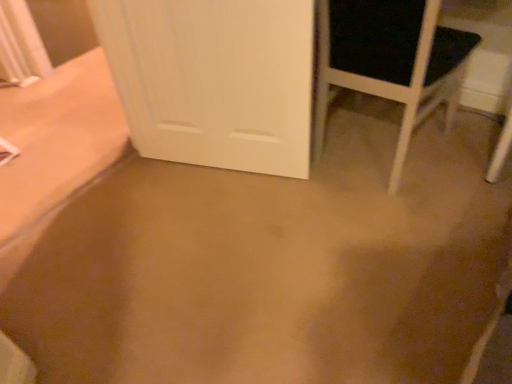
This screenshot has height=384, width=512. Describe the element at coordinates (214, 79) in the screenshot. I see `white wood door at center` at that location.

Locate an element on the screen. This screenshot has width=512, height=384. white wood door at center is located at coordinates (214, 79).

Describe the element at coordinates (390, 61) in the screenshot. I see `black matte chair at right` at that location.

Locate an element on the screen. The width and height of the screenshot is (512, 384). black matte chair at right is located at coordinates (390, 61).

Where is `white wood door at center`? The width and height of the screenshot is (512, 384). white wood door at center is located at coordinates (214, 79).

In the image, is black matte chair at right on the left side or the right side of white wood door at center?

From the image, it's evident that black matte chair at right is to the right of white wood door at center.

Is black matte chair at right positioned behind white wood door at center?

No, it is not.

Does point (391, 32) appear closer or farther from the camera than point (165, 70)?

Point (391, 32) appears to be closer to the viewer than point (165, 70).

From the image's perspective, is black matte chair at right under white wood door at center?

Actually, black matte chair at right appears above white wood door at center in the image.

From a real-world perspective, is black matte chair at right physically located above or below white wood door at center?

From a real-world perspective, black matte chair at right is physically below white wood door at center.

Can you confirm if black matte chair at right is thinner than white wood door at center?

In fact, black matte chair at right might be wider than white wood door at center.

From their relative heights in the image, would you say black matte chair at right is taller or shorter than white wood door at center?

Considering their sizes, black matte chair at right has less height than white wood door at center.

Between black matte chair at right and white wood door at center, which one has larger size?

black matte chair at right.

Do you think black matte chair at right is within white wood door at center, or outside of it?

black matte chair at right lies outside white wood door at center.

Is black matte chair at right not near white wood door at center?

Actually, black matte chair at right and white wood door at center are a little close together.

Is black matte chair at right oriented towards white wood door at center?

Yes.

Where is `chair in front of the white wood door at center`? The image size is (512, 384). chair in front of the white wood door at center is located at coordinates (390, 61).

Which object is positioned more to the left, white wood door at center or black matte chair at right?

white wood door at center.

Considering their positions, is white wood door at center located in front of or behind black matte chair at right?

white wood door at center is positioned farther from the viewer than black matte chair at right.

Which is less distant, (301,31) or (414,122)?

Positioned in front is point (301,31).

From the image's perspective, which one is positioned higher, white wood door at center or black matte chair at right?

black matte chair at right is shown above in the image.

From a real-world perspective, between white wood door at center and black matte chair at right, who is vertically higher?

white wood door at center.

Considering the sizes of white wood door at center and black matte chair at right in the image, is white wood door at center wider or thinner than black matte chair at right?

Considering their sizes, white wood door at center looks slimmer than black matte chair at right.

From the picture: Is white wood door at center taller or shorter than black matte chair at right?

white wood door at center is taller than black matte chair at right.

Considering the relative sizes of white wood door at center and black matte chair at right in the image provided, is white wood door at center smaller than black matte chair at right?

Correct, white wood door at center occupies less space than black matte chair at right.

Would you say black matte chair at right is part of white wood door at center's contents?

No.

Are white wood door at center and black matte chair at right far apart?

Result: No, white wood door at center is not far away from black matte chair at right.

Does white wood door at center turn towards black matte chair at right?

No, white wood door at center is not turned towards black matte chair at right.

You are a GUI agent. You are given a task and a screenshot of the screen. Output one action in this format:
    pyautogui.click(x=<x>, y=<y>)
    Task: Click on the chair above the white wood door at center (from the image's perspective)
    
    Given the screenshot: What is the action you would take?
    pyautogui.click(x=390, y=61)

The height and width of the screenshot is (384, 512). I want to click on door located above the black matte chair at right (from a real-world perspective), so click(214, 79).

I want to click on chair above the white wood door at center (from the image's perspective), so click(390, 61).